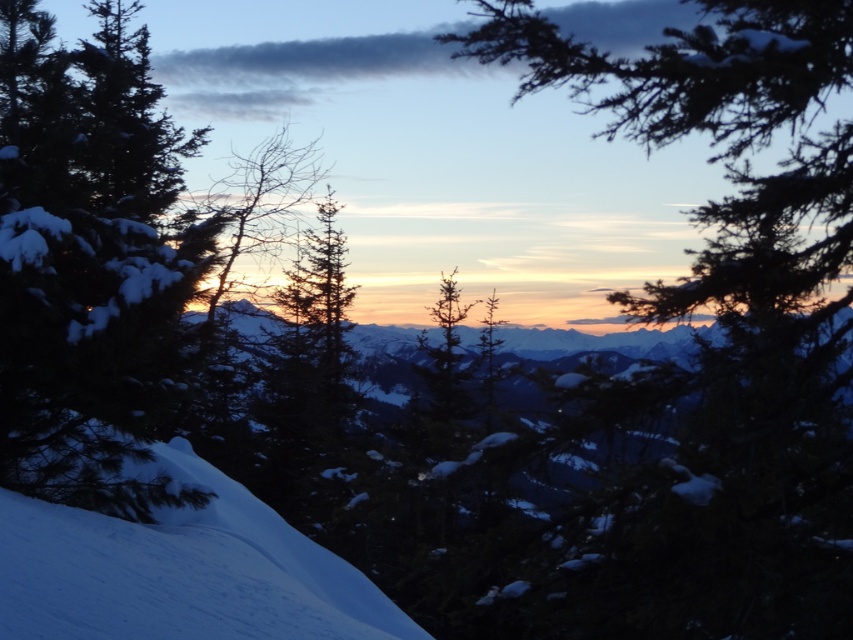
Based on the scene description, where is the green matte tree at upper right located in the image?

The green matte tree at upper right is located at point (723, 336).